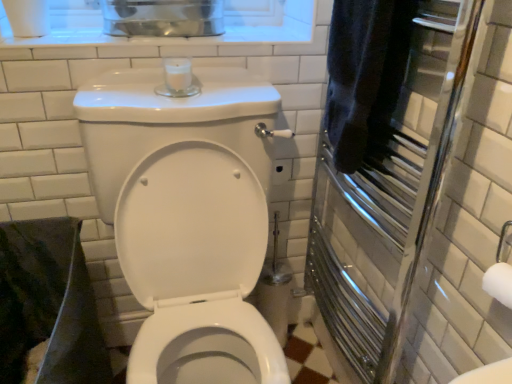
Question: Based on their positions, is white glossy toilet at center located to the left or right of dark blue towel at right?

Choices:
 (A) right
 (B) left

Answer: (B)

Question: Looking at their shapes, would you say white glossy toilet at center is wider or thinner than dark blue towel at right?

Choices:
 (A) wide
 (B) thin

Answer: (A)

Question: Based on their relative distances, which object is nearer to the white glossy toilet at center?

Choices:
 (A) dark blue towel at right
 (B) polished chrome towel warmer at right

Answer: (B)

Question: Estimate the real-world distances between objects in this image. Which object is closer to the dark blue towel at right?

Choices:
 (A) polished chrome towel warmer at right
 (B) white glossy toilet at center

Answer: (A)